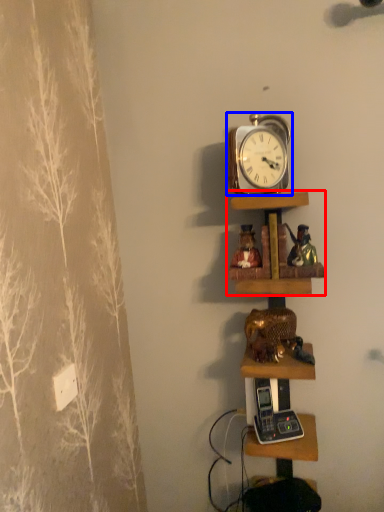
Question: Which object is further to the camera taking this photo, shelf (highlighted by a red box) or alarm clock (highlighted by a blue box)?

Choices:
 (A) shelf
 (B) alarm clock

Answer: (A)